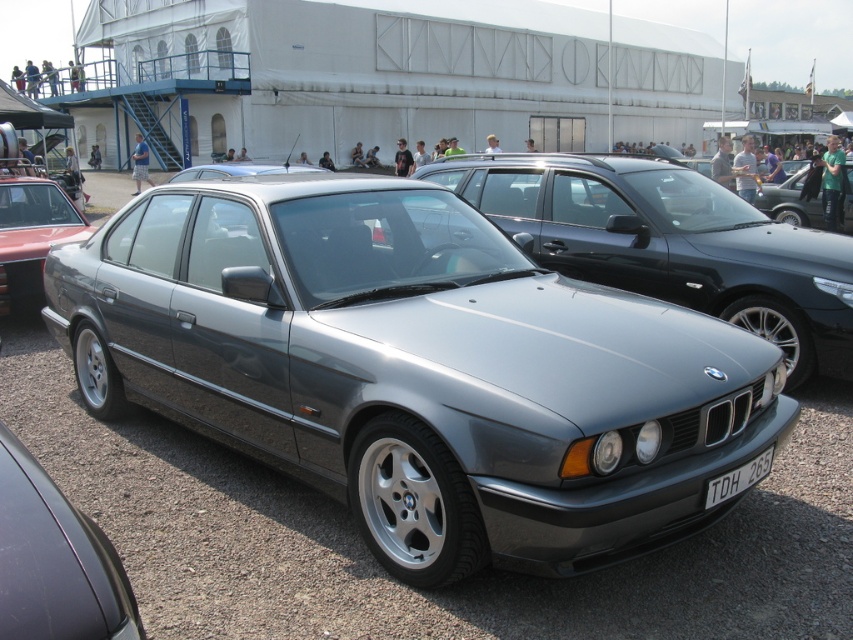
You are a photographer planning to take a photo of the satin metallic sedan at center and the satin silver car at center. Since you want both cars to appear proportionally sized in the frame, which car should you move closer to?

To make both cars appear proportionally sized in the frame, you should move closer to the satin metallic sedan at center because it is wider than the satin silver car at center. By moving closer to the wider car, its size in the photo will reduce relative to the narrower one, balancing their apparent sizes.

You are a photographer at a car exhibition. You need to capture a photo that includes both the satin metallic car at center and the metallic gray sedan at left. Based on their positions, which car should be placed closer to the bottom of the frame?

The satin metallic car at center should be placed closer to the bottom of the frame because it is positioned below the metallic gray sedan at left.

You are standing in front of a classic car exhibition and see a point marked at coordinate [672,244]. Which object does this coordinate correspond to?

The point at coordinate [672,244] corresponds to the satin metallic sedan at center.